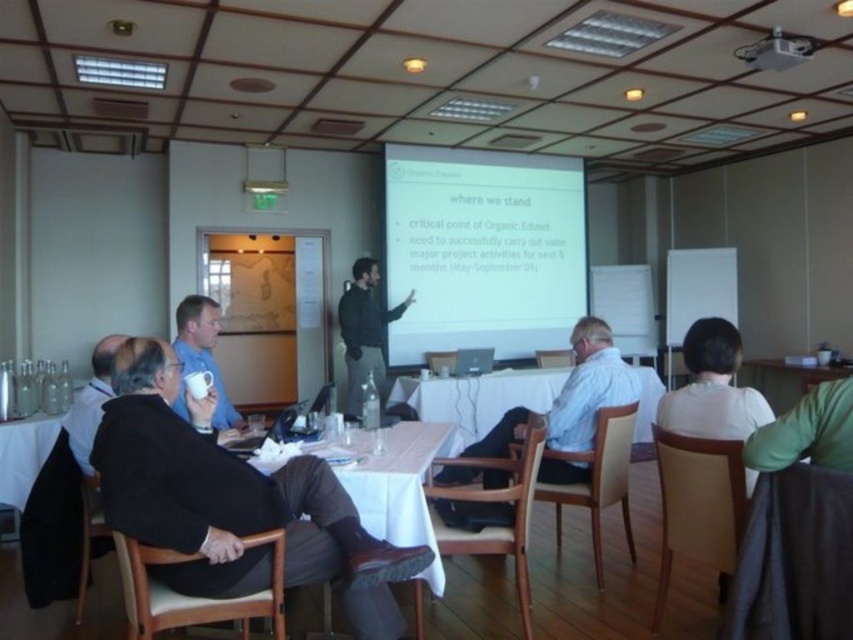
Question: Is light blue shirt at center wider than white plastic projector at upper center?

Choices:
 (A) no
 (B) yes

Answer: (B)

Question: Which point is farther to the camera?

Choices:
 (A) (492, 433)
 (B) (344, 480)
 (C) (810, 42)

Answer: (C)

Question: Which point is farther to the camera?

Choices:
 (A) (105, 397)
 (B) (457, 408)
 (C) (402, 556)

Answer: (B)

Question: Considering the relative positions of black leather jacket at lower left and white matte projection screen at center in the image provided, where is black leather jacket at lower left located with respect to white matte projection screen at center?

Choices:
 (A) below
 (B) above

Answer: (A)

Question: Which object appears farthest from the camera in this image?

Choices:
 (A) white matte projection screen at center
 (B) white tablecloth at center

Answer: (A)

Question: From the image, what is the correct spatial relationship of light blue shirt at center in relation to dark green sweater at center?

Choices:
 (A) below
 (B) above

Answer: (A)